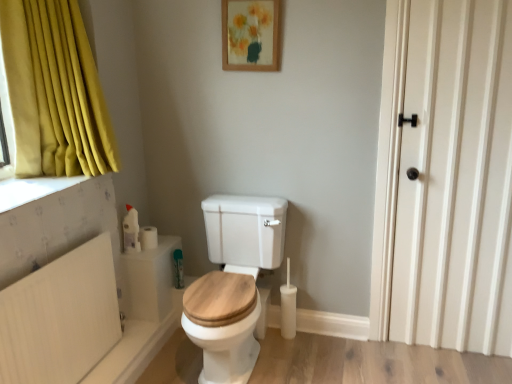
This screenshot has width=512, height=384. What are the coordinates of `vacant space in front of white matte toilet paper at lower left, the first toilet paper viewed from the back` in the screenshot? It's located at (146, 251).